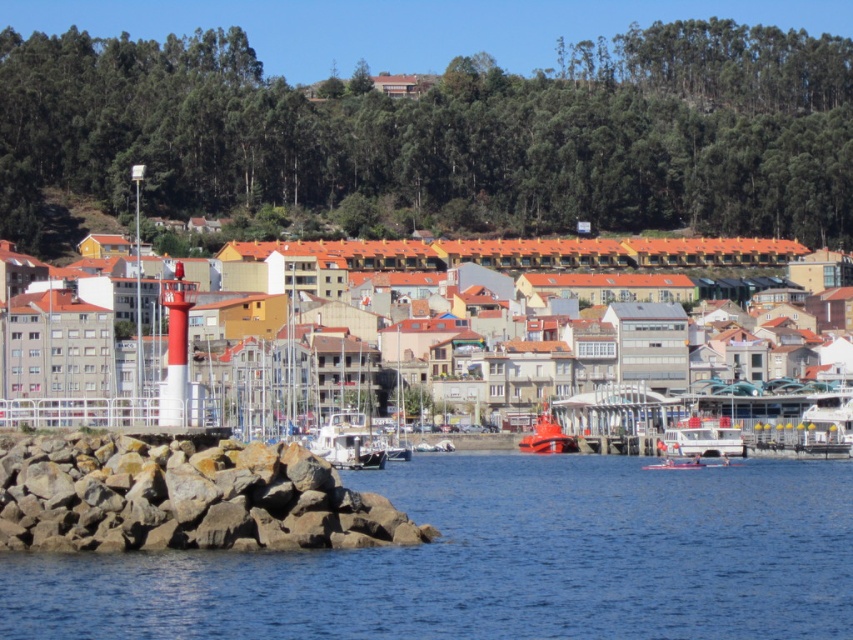
Question: Which point is closer to the camera?

Choices:
 (A) rubberized orange boat at center
 (B) rocky at lower left

Answer: (B)

Question: In this image, where is blue water at lower left located relative to rocky at lower left?

Choices:
 (A) left
 (B) right

Answer: (B)

Question: Does white matte boat at center appear under rubberized orange boat at center?

Choices:
 (A) no
 (B) yes

Answer: (A)

Question: Which of the following is the closest to the observer?

Choices:
 (A) white matte boat at center
 (B) white plastic boat at center
 (C) blue water at lower left
 (D) rocky at lower left

Answer: (C)

Question: Does blue water at lower left appear on the right side of rocky at lower left?

Choices:
 (A) yes
 (B) no

Answer: (A)

Question: Which of the following is the farthest from the observer?

Choices:
 (A) rubberized orange boat at center
 (B) rocky at lower left
 (C) white matte boat at center
 (D) smooth white lighthouse at left

Answer: (A)